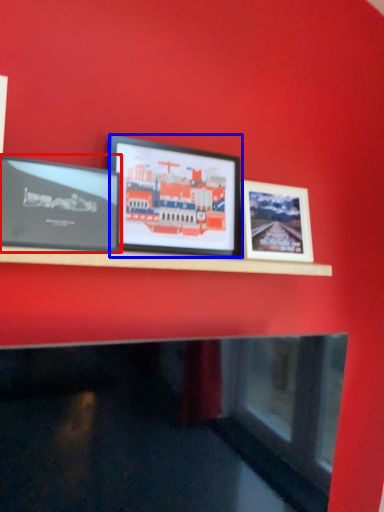
Question: Which object is further to the camera taking this photo, picture frame (highlighted by a red box) or picture frame (highlighted by a blue box)?

Choices:
 (A) picture frame
 (B) picture frame

Answer: (B)